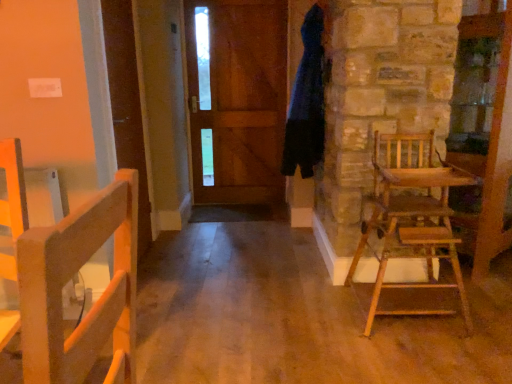
Question: Is wooden high chair at right situated inside wooden door at center or outside?

Choices:
 (A) outside
 (B) inside

Answer: (A)

Question: Is wooden high chair at right taller or shorter than wooden door at center?

Choices:
 (A) short
 (B) tall

Answer: (A)

Question: Which object is positioned closest to the dark blue fabric bathrobe at upper right?

Choices:
 (A) wooden high chair at right
 (B) wooden door at center

Answer: (A)

Question: Which object is positioned farthest from the dark blue fabric bathrobe at upper right?

Choices:
 (A) wooden door at center
 (B) wooden high chair at right

Answer: (A)